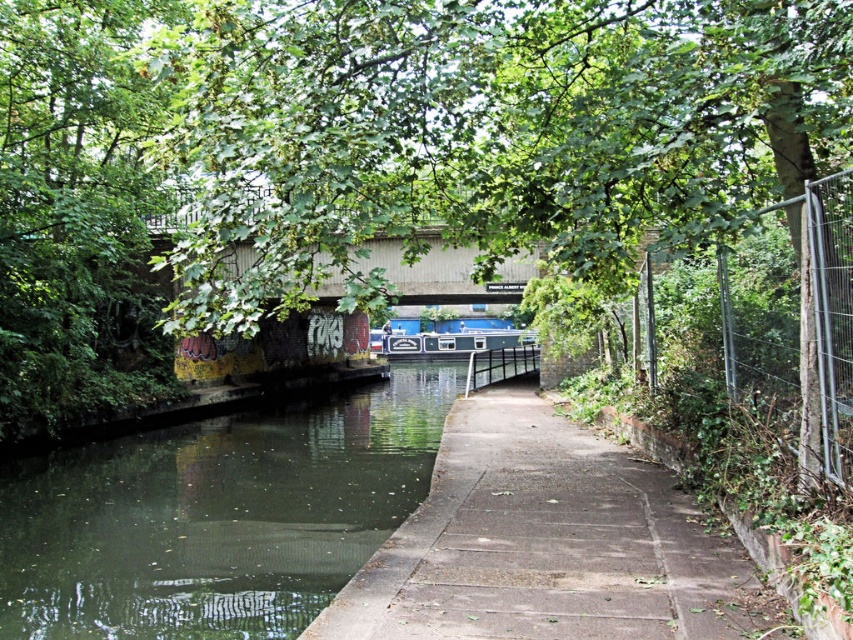
Question: Which object is farther from the camera taking this photo?

Choices:
 (A) blue glossy canal boat at center
 (B) concrete at center

Answer: (A)

Question: Can you confirm if metallic wire fence at right is wider than blue glossy canal boat at center?

Choices:
 (A) no
 (B) yes

Answer: (A)

Question: Is green concrete river at center below concrete at center?

Choices:
 (A) yes
 (B) no

Answer: (A)

Question: Can you confirm if green concrete river at center is thinner than blue glossy canal boat at center?

Choices:
 (A) no
 (B) yes

Answer: (B)

Question: Among these points, which one is nearest to the camera?

Choices:
 (A) (432, 432)
 (B) (332, 268)

Answer: (A)

Question: Which point is farther to the camera?

Choices:
 (A) metallic wire fence at right
 (B) green concrete river at center
 (C) metallic gray bridge at upper center

Answer: (B)